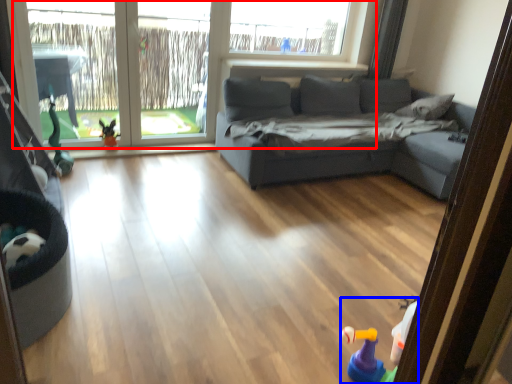
Question: Among these objects, which one is nearest to the camera, window (highlighted by a red box) or toy (highlighted by a blue box)?

Choices:
 (A) window
 (B) toy

Answer: (B)